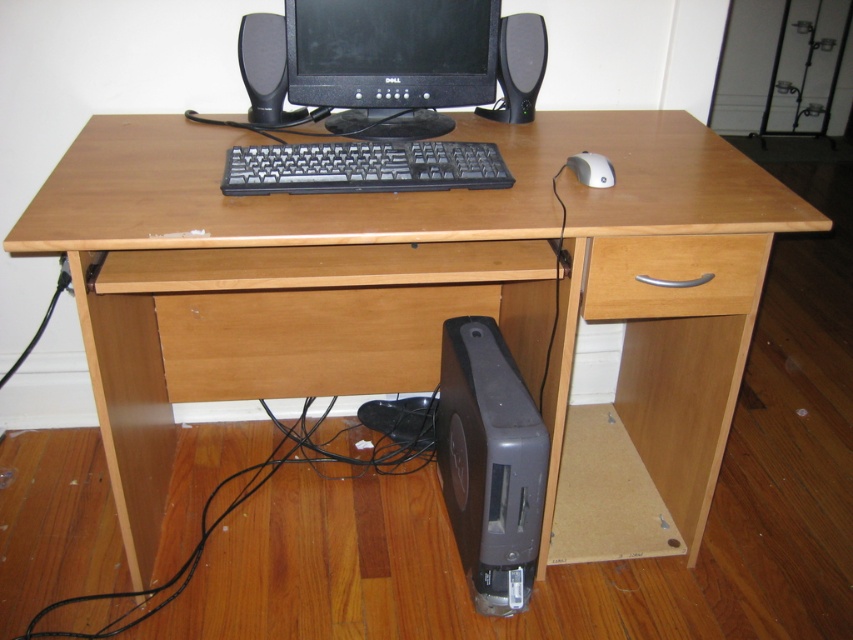
Who is lower down, wooden drawer at lower center or beech wood drawer at right?

Positioned lower is wooden drawer at lower center.

Does wooden drawer at lower center have a lesser width compared to beech wood drawer at right?

Incorrect, wooden drawer at lower center's width is not less than beech wood drawer at right's.

Does point (321, 308) come farther from viewer compared to point (743, 257)?

Yes, point (321, 308) is farther from viewer.

Where is `wooden drawer at lower center`? This screenshot has height=640, width=853. wooden drawer at lower center is located at coordinates point(309,339).

The width and height of the screenshot is (853, 640). I want to click on black matte monitor at center, so click(x=392, y=61).

Does black matte monitor at center come behind black plastic speaker at upper center?

No.

Does point (286, 1) lie behind point (283, 64)?

That is False.

At what (x,y) coordinates should I click in order to perform the action: click on black matte monitor at center. Please return your answer as a coordinate pair (x, y). The image size is (853, 640). Looking at the image, I should click on (392, 61).

Can you confirm if black plastic keyboard at center is thinner than silver/plastic mouse at upper right?

In fact, black plastic keyboard at center might be wider than silver/plastic mouse at upper right.

Find the location of `black plastic keyboard at center`. black plastic keyboard at center is located at coordinates (363, 168).